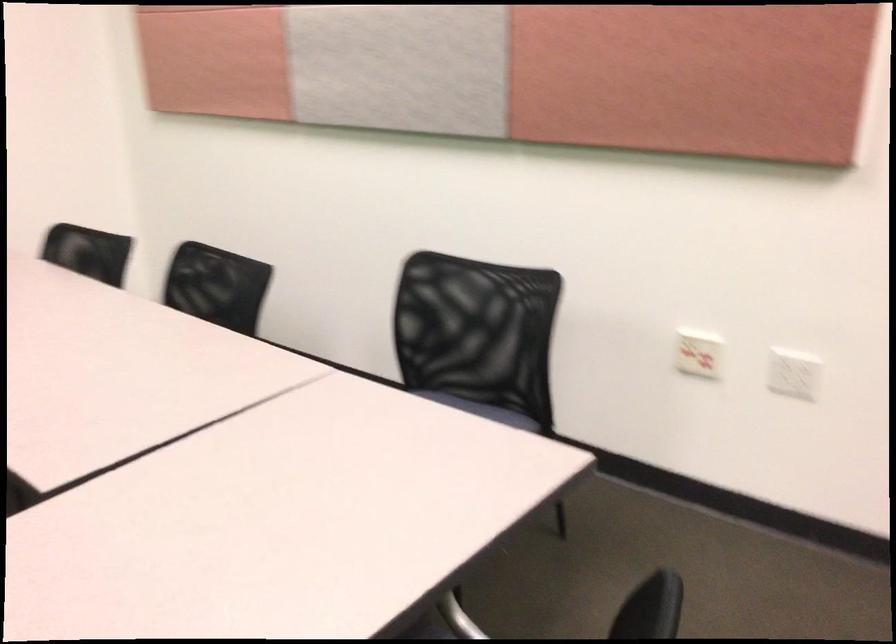
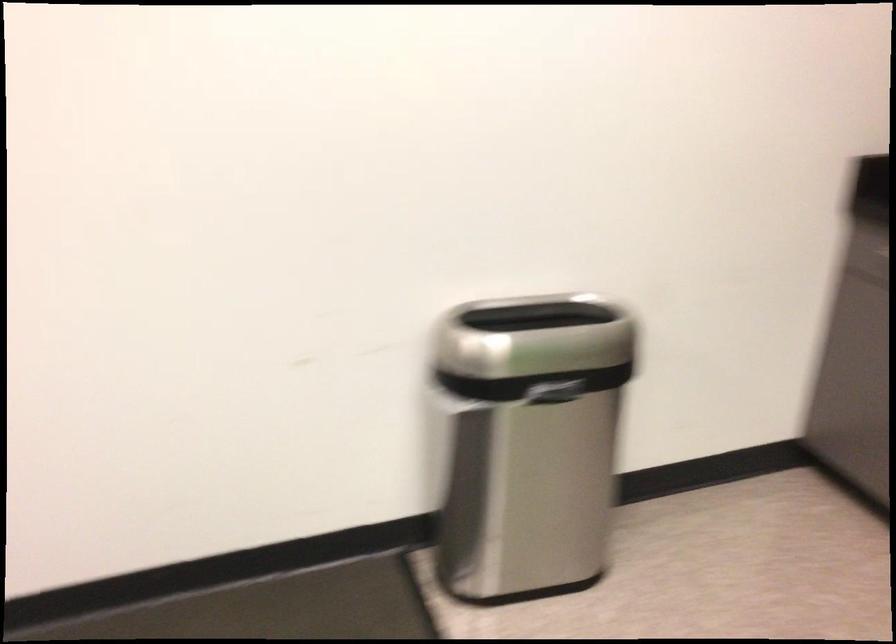
Question: The camera is either moving clockwise (left) or counter-clockwise (right) around the object. The first image is from the beginning of the video and the second image is from the end. Is the camera moving left or right when shooting the video?

Choices:
 (A) Left
 (B) Right

Answer: (A)